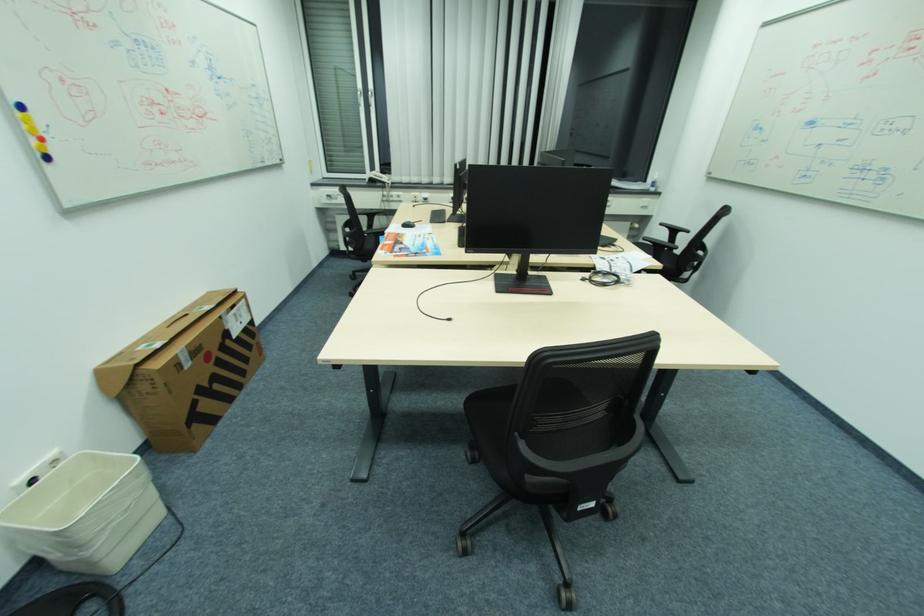
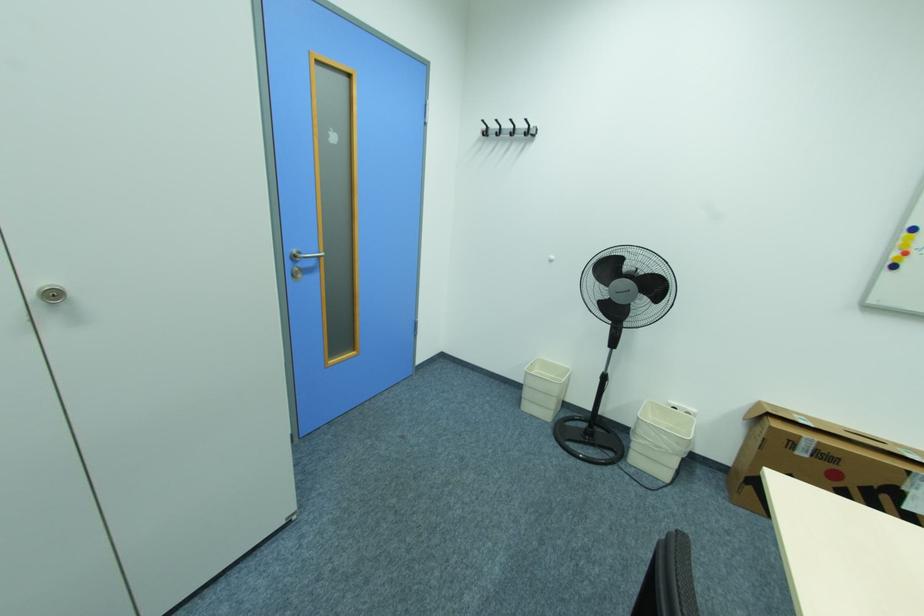
Locate, in the second image, the point that corresponds to point (181, 355) in the first image.

(805, 437)